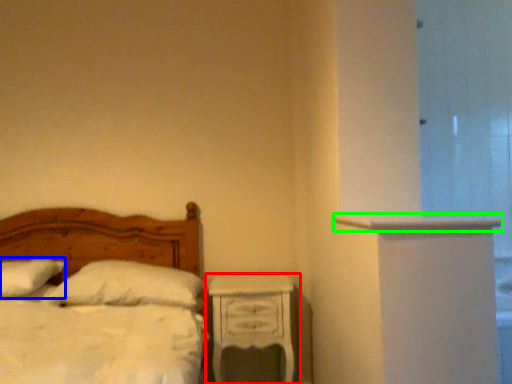
Question: Which object is positioned farthest from nightstand (highlighted by a red box)? Select from pillow (highlighted by a blue box) and ledge (highlighted by a green box).

Choices:
 (A) pillow
 (B) ledge

Answer: (A)